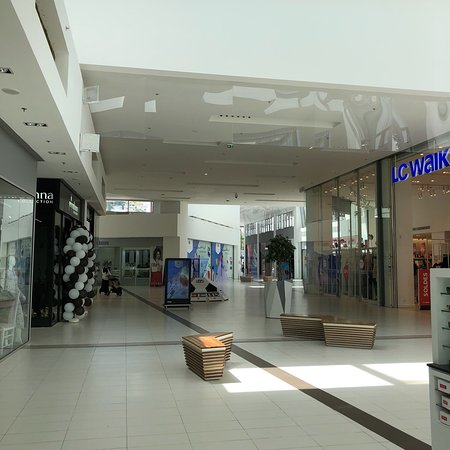
I want to click on security camera, so click(236, 197), click(228, 143).